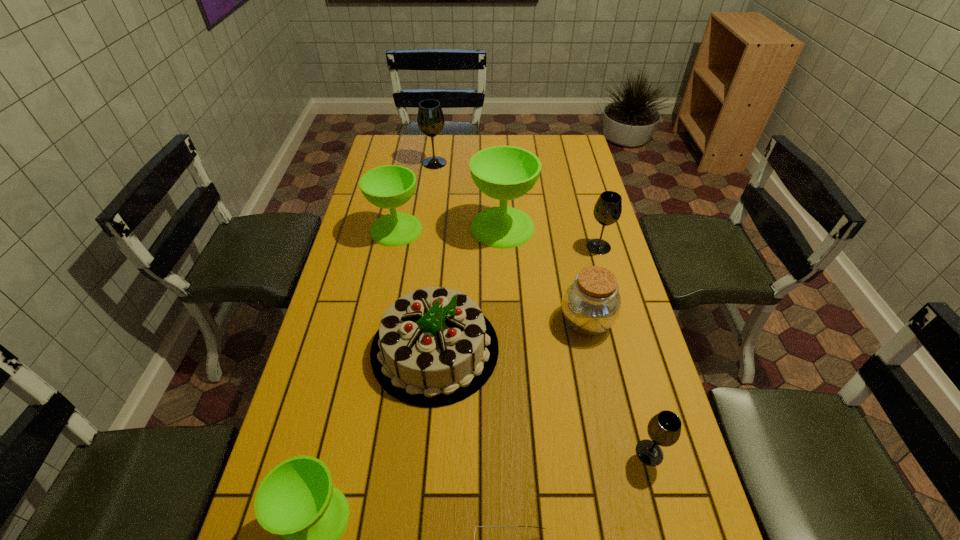
This screenshot has height=540, width=960. I want to click on jar that is positioned at the right edge, so click(x=591, y=304).

Find the location of a particular element. The width and height of the screenshot is (960, 540). vacant space at the far edge of the desktop is located at coordinates (463, 163).

In the image, there is a desktop. Where is `vacant space at the left edge`? vacant space at the left edge is located at coordinates (366, 206).

The height and width of the screenshot is (540, 960). In the image, there is a desktop. What are the coordinates of `free space at the right edge` in the screenshot? It's located at (566, 248).

Find the location of `free space at the far left corner of the desktop`. free space at the far left corner of the desktop is located at coordinates (388, 147).

Locate an element on the screen. This screenshot has width=960, height=540. vacant region between the second biggest green wineglass and the green birthday cake is located at coordinates (416, 289).

Locate an element on the screen. The image size is (960, 540). vacant area that lies between the rightmost green wineglass and the farthest wineglass is located at coordinates (468, 195).

What are the coordinates of `blank region between the farthest gray wineglass and the fourth wineglass from left to right` in the screenshot? It's located at (468, 195).

Image resolution: width=960 pixels, height=540 pixels. Identify the location of vacant area between the second biggest green wineglass and the birthday cake. (416, 289).

Find the location of a particular element. The image size is (960, 540). unoccupied area between the birthday cake and the second smallest green wineglass is located at coordinates (416, 289).